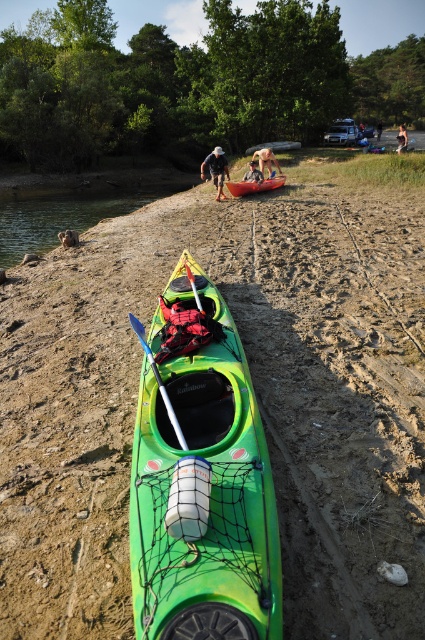
Question: Is light brown wooden paddle at upper center above skinny man at center?

Choices:
 (A) no
 (B) yes

Answer: (A)

Question: Can you confirm if light brown wooden paddle at upper center is wider than smooth skin person at center?

Choices:
 (A) no
 (B) yes

Answer: (A)

Question: Which point is farther from the camera taking this photo?

Choices:
 (A) (405, 140)
 (B) (283, 180)
 (C) (376, 131)

Answer: (C)

Question: Which of the following is the farthest from the observer?

Choices:
 (A) (237, 483)
 (B) (220, 156)
 (C) (189, 276)
 (D) (401, 132)

Answer: (D)

Question: Based on their relative distances, which object is farther from the skinny man at center?

Choices:
 (A) light brown wooden paddle at center
 (B) white plastic paddle at center
 (C) matte red canoe at center
 (D) green matte kayak at center

Answer: (B)

Question: Where is matte red canoe at center located in relation to blue plastic paddle at center in the image?

Choices:
 (A) above
 (B) below

Answer: (A)